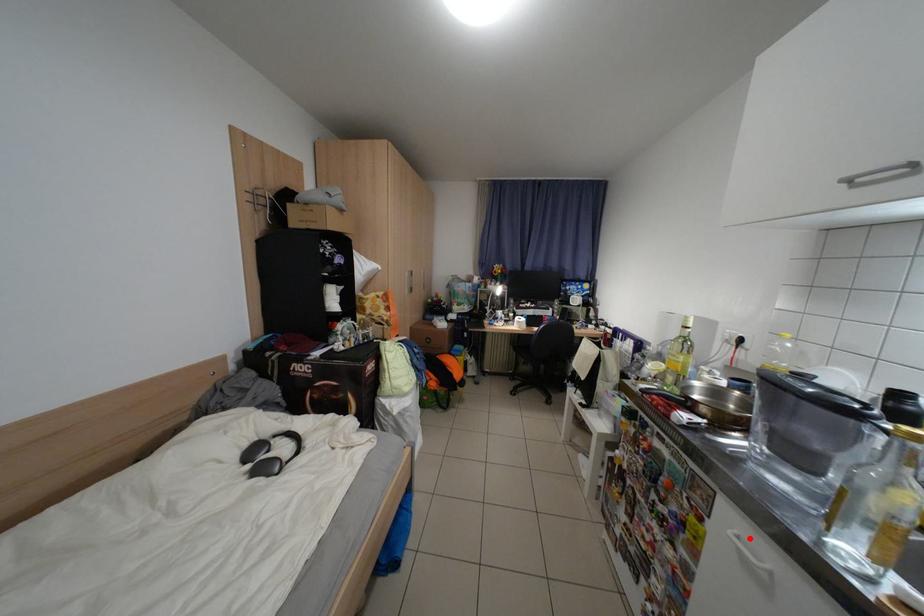
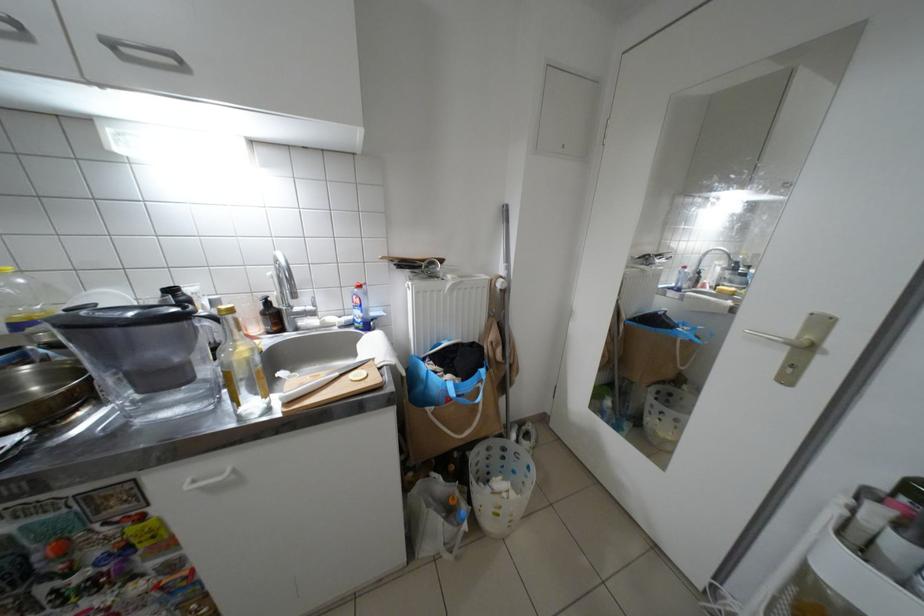
Locate, in the second image, the point that corresponds to the highlighted location in the first image.

(205, 483)